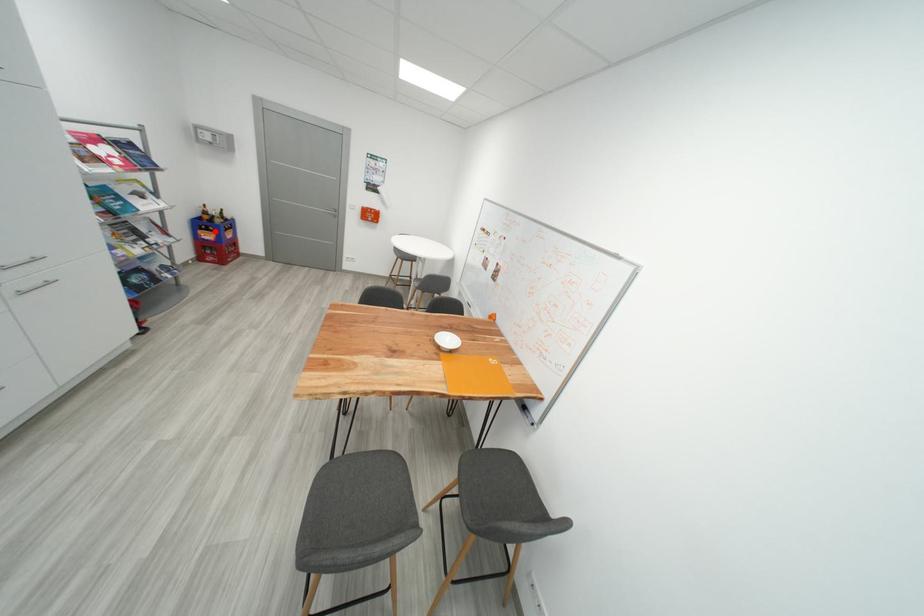
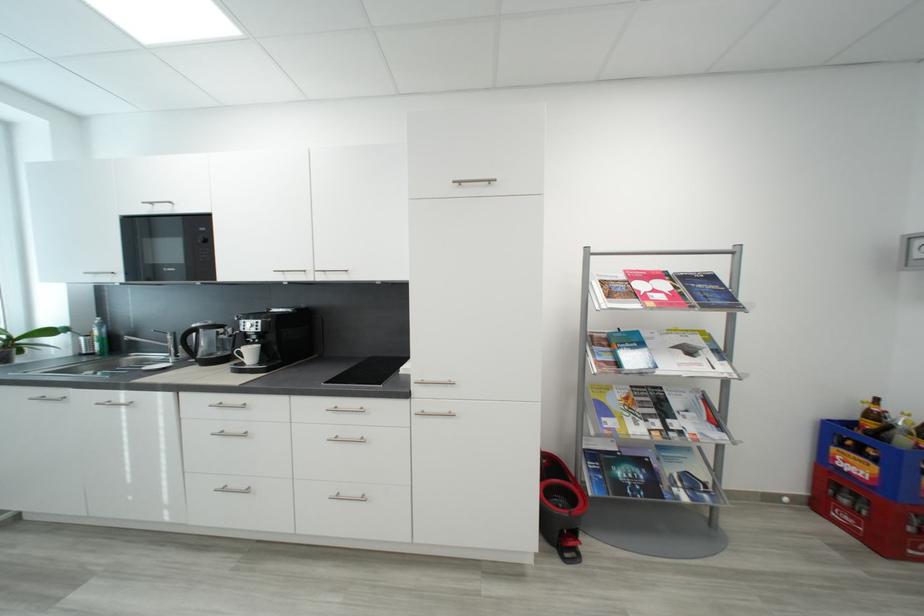
Question: I am providing you with two images of the same scene from different viewpoints. Image1 has a red point marked. In image2, the corresponding 3D location appears at what relative position? Reply with the corresponding letter.

Choices:
 (A) Closer
 (B) Farther

Answer: (A)